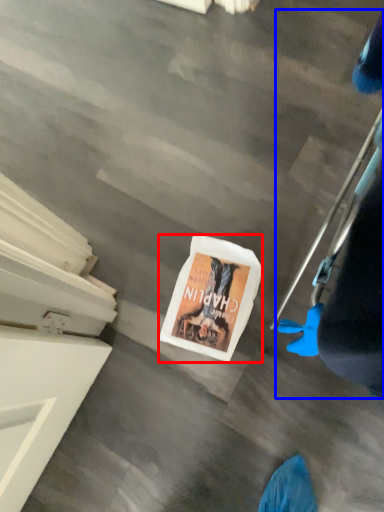
Question: Which of the following is the closest to the observer, magazine (highlighted by a red box) or person (highlighted by a blue box)?

Choices:
 (A) magazine
 (B) person

Answer: (B)